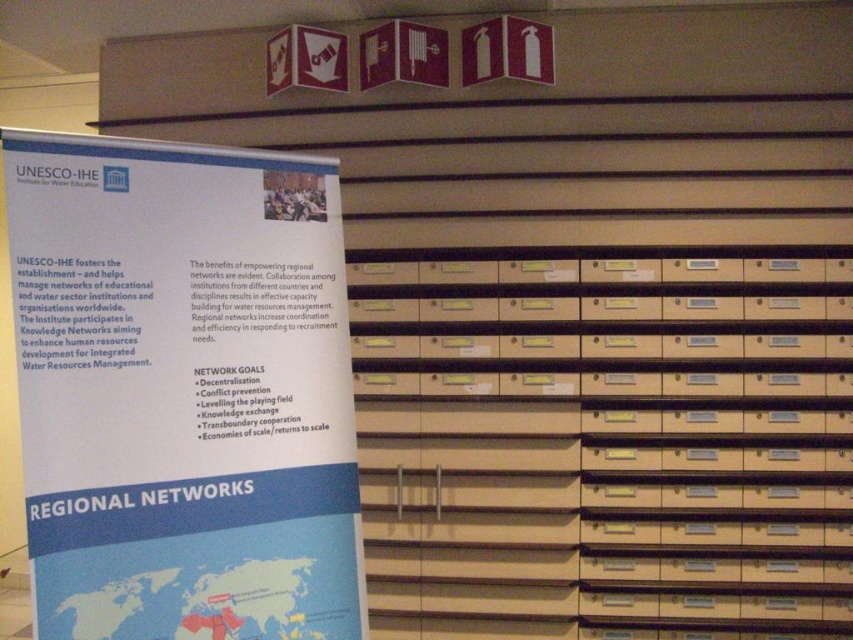
Looking at this image, what is the 2D coordinate of the beige cardboard drawers at center?

The beige cardboard drawers at center are located at point (605, 440).

You are an office worker who needs to hang a new poster that is 1.5 meters tall. You have two options for placement in the library scene described. Which object from the scene would be suitable for hanging this poster, considering their height? The beige cardboard drawers at center or the white paper poster at left?

The beige cardboard drawers at center is much taller than the white paper poster at left, so the beige cardboard drawers at center would be suitable for hanging the 1.5 meters tall poster since it can accommodate the height requirement.

You are organizing a library and need to place a beige cardboard drawers at center and a white paper poster at left. According to the scene, where should each item be placed relative to each other?

The beige cardboard drawers at center should be placed to the right of the white paper poster at left, as stated in the objects description.